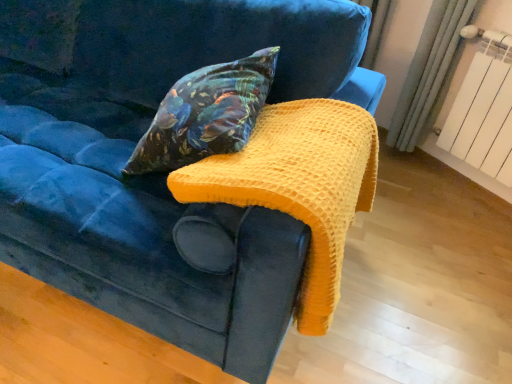
Find the location of `free point below white painted metal radiator at upper right (from a real-world perspective)`. free point below white painted metal radiator at upper right (from a real-world perspective) is located at coordinates (461, 191).